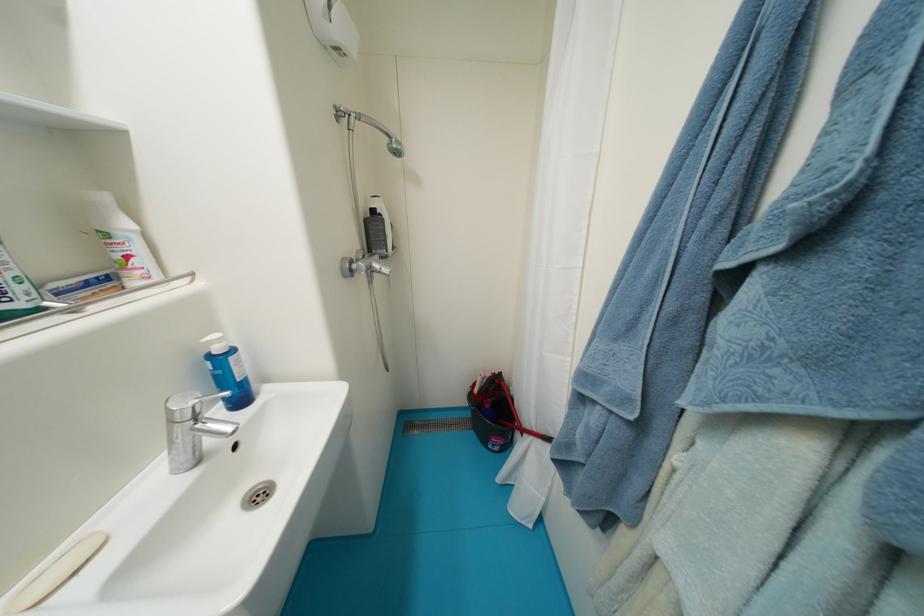
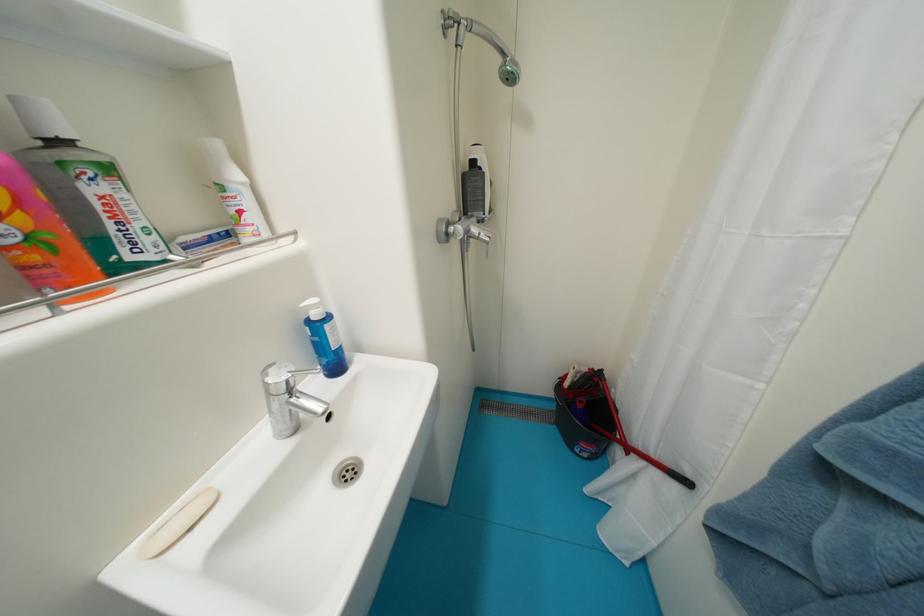
What movement of the cameraman would produce the second image?

The cameraman moved toward left, forward.